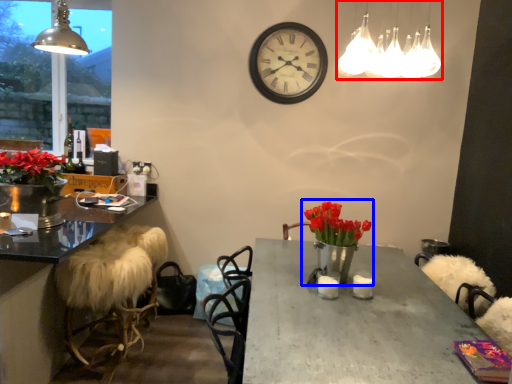
Question: Which object is closer to the camera taking this photo, lamp (highlighted by a red box) or floral arrangement (highlighted by a blue box)?

Choices:
 (A) lamp
 (B) floral arrangement

Answer: (A)